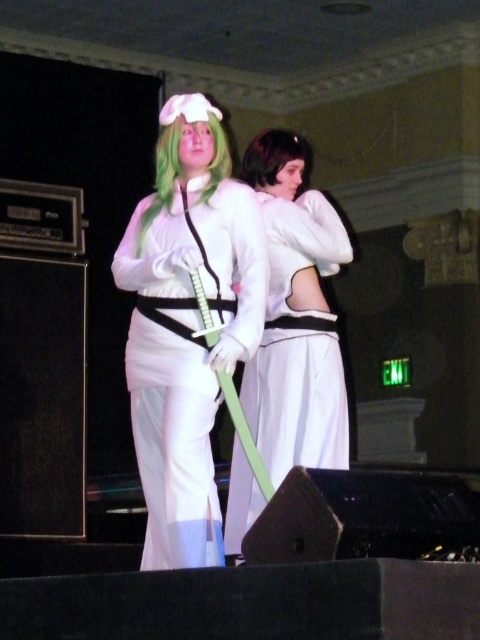
Question: Which point appears farthest from the camera in this image?

Choices:
 (A) (259, 176)
 (B) (166, 196)
 (C) (168, 429)

Answer: (A)

Question: Does white matte/soft fabric dress at center have a larger size compared to black matte hair at upper center?

Choices:
 (A) no
 (B) yes

Answer: (B)

Question: Is white matte cosplay outfit at center further to camera compared to green silky hair at center?

Choices:
 (A) no
 (B) yes

Answer: (A)

Question: Which point appears closest to the camera in this image?

Choices:
 (A) (225, 177)
 (B) (277, 132)

Answer: (A)

Question: Does white matte/soft fabric dress at center have a greater width compared to black matte hair at upper center?

Choices:
 (A) no
 (B) yes

Answer: (B)

Question: Among these points, which one is farthest from the camera?

Choices:
 (A) (307, 179)
 (B) (290, 259)
 (C) (171, 132)

Answer: (A)